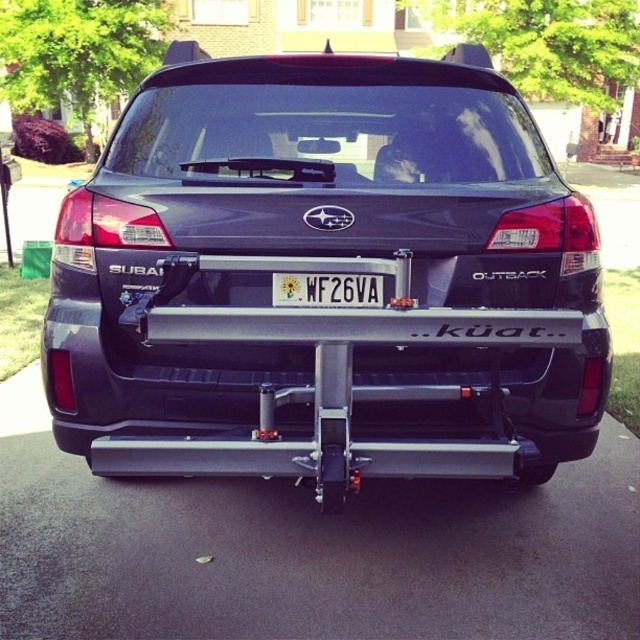
You are a delivery person trying to attach a GPS tracker to the Subaru Outback. The tracker must be placed on the metallic gray hitch at center without covering the white plastic license plate at center. Is this possible?

The metallic gray hitch at center is in front of the white plastic license plate at center, so placing the GPS tracker on the metallic gray hitch at center would not cover the white plastic license plate at center.

You are a delivery person trying to attach a small package to the Subaru Outback. The package is too big to fit on the roof rack. You notice the metallic gray hitch at center and the white plastic license plate at center. Which object is taller so you can attach the package there?

The metallic gray hitch at center is taller than the white plastic license plate at center, so you can attach the package to the metallic gray hitch at center.